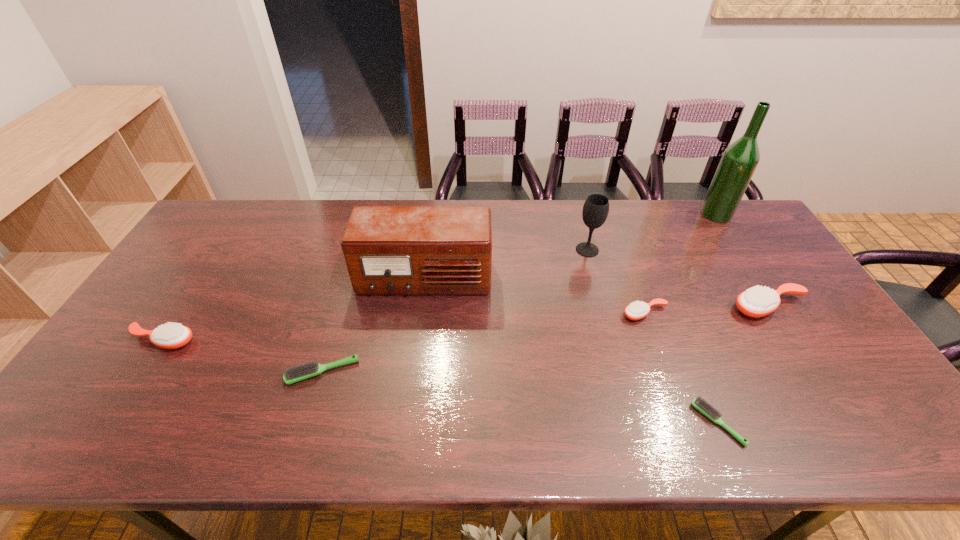
Identify the location of free location located 0.210m on the left of the second nearest hairbrush. (204, 372).

The width and height of the screenshot is (960, 540). Find the location of `vacant space located on the back of the shortest hairbrush`. vacant space located on the back of the shortest hairbrush is located at coordinates (675, 320).

You are a GUI agent. You are given a task and a screenshot of the screen. Output one action in this format:
    pyautogui.click(x=<x>, y=<y>)
    Task: Click on the object present at the far edge
    This screenshot has width=960, height=540.
    Given the screenshot: What is the action you would take?
    pyautogui.click(x=739, y=161)

Find the location of a particular element. The height and width of the screenshot is (540, 960). object located at the near edge is located at coordinates (704, 407).

At what (x,y) coordinates should I click in order to perform the action: click on object positioned at the left edge. Please return your answer as a coordinate pair (x, y). Looking at the image, I should click on (172, 335).

The height and width of the screenshot is (540, 960). Identify the location of alcohol that is at the right edge. (739, 161).

Locate an element on the screen. This screenshot has width=960, height=540. hairbrush that is at the right edge is located at coordinates (758, 301).

Locate an element on the screen. Image resolution: width=960 pixels, height=540 pixels. object present at the far right corner is located at coordinates (739, 161).

In the image, there is a desktop. Where is `vacant space at the far edge`? Image resolution: width=960 pixels, height=540 pixels. vacant space at the far edge is located at coordinates (660, 231).

The height and width of the screenshot is (540, 960). Identify the location of free point at the near edge. (563, 444).